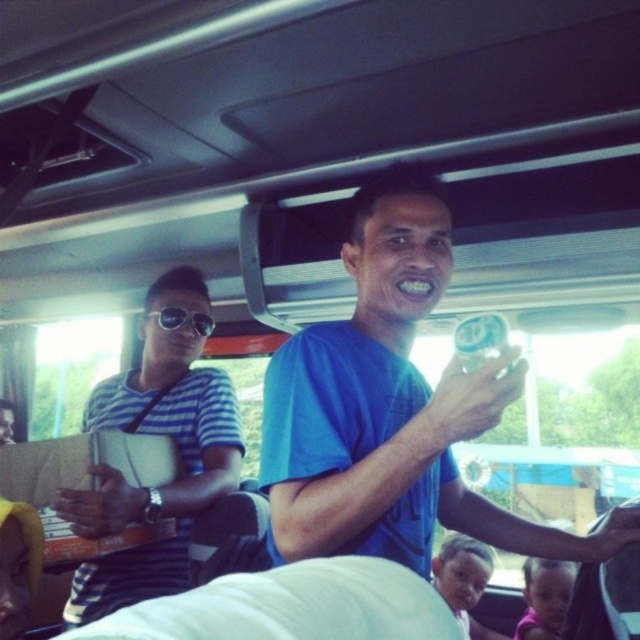
Question: Which object is farther from the camera taking this photo?

Choices:
 (A) black reflective sunglasses at upper center
 (B) blue matte shirt at center
 (C) striped fabric shirt at left

Answer: (A)

Question: From the image, what is the correct spatial relationship of blue matte shirt at center in relation to striped fabric shirt at left?

Choices:
 (A) above
 (B) below

Answer: (A)

Question: Which point is closer to the camera?

Choices:
 (A) (211, 330)
 (B) (413, 484)

Answer: (B)

Question: Which object is positioned closest to the blue matte shirt at center?

Choices:
 (A) striped fabric shirt at left
 (B) black reflective sunglasses at upper center

Answer: (A)

Question: Is blue matte shirt at center wider than black reflective sunglasses at upper center?

Choices:
 (A) no
 (B) yes

Answer: (B)

Question: Does blue matte shirt at center appear on the right side of striped fabric shirt at left?

Choices:
 (A) no
 (B) yes

Answer: (B)